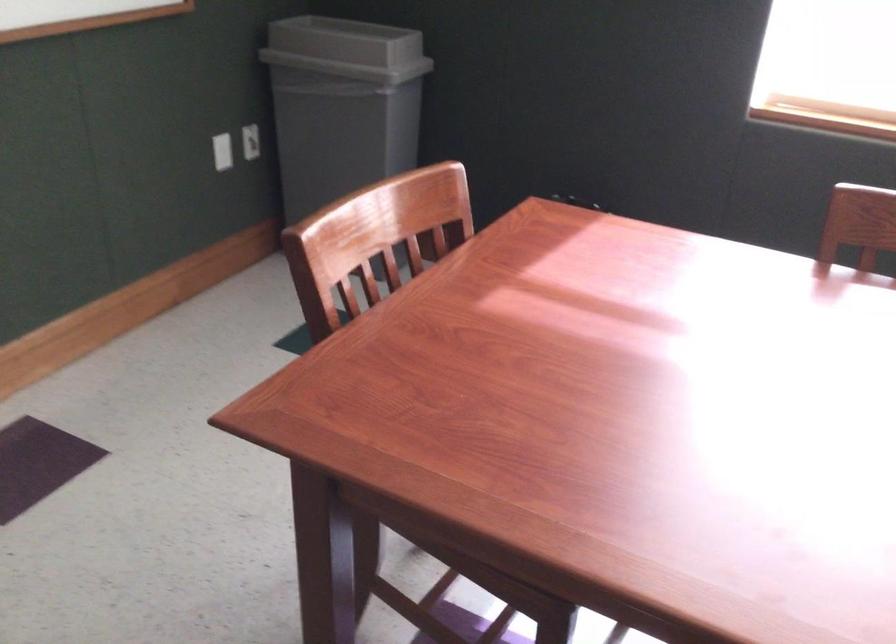
Where is `grey trash can lid`? grey trash can lid is located at coordinates (346, 49).